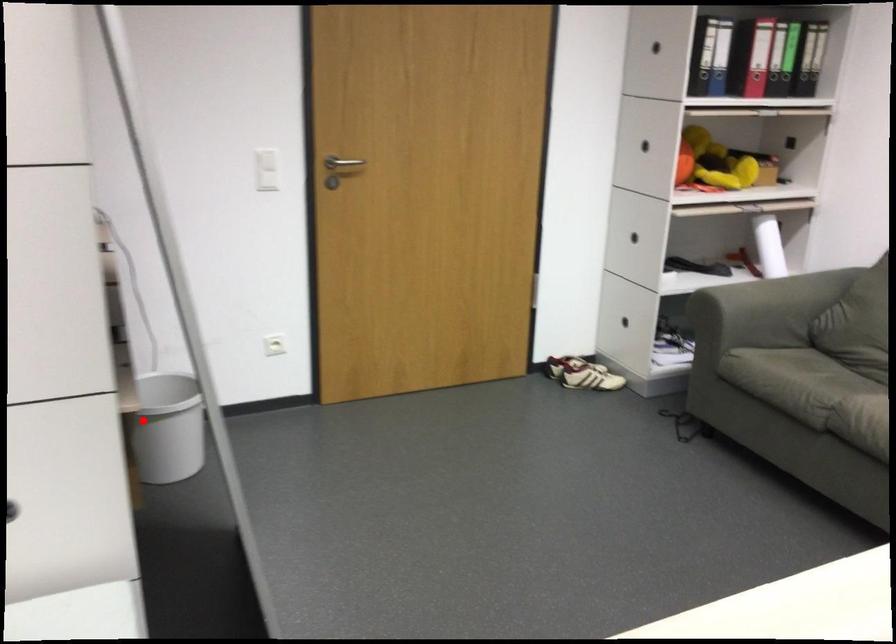
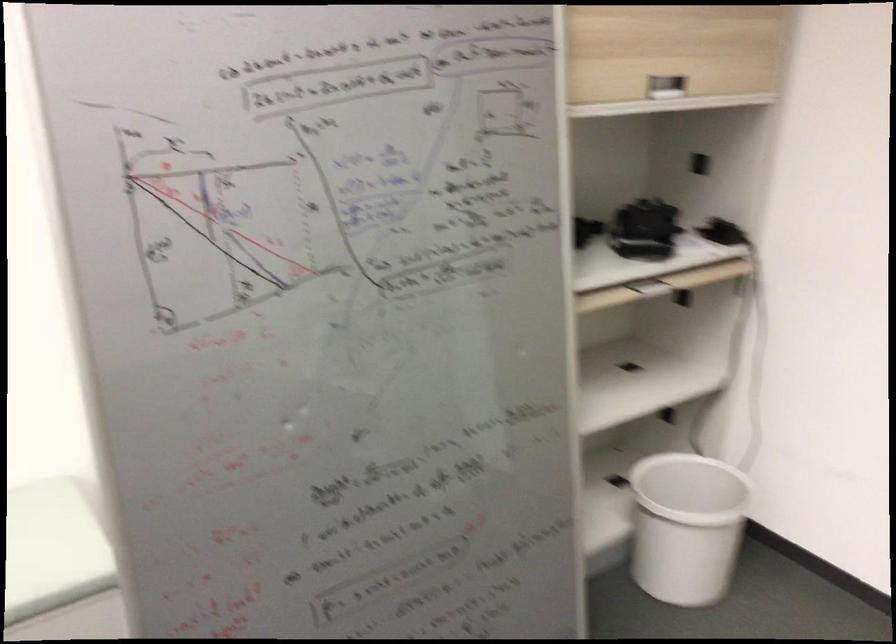
Question: I am providing you with two images of the same scene from different viewpoints. Given a red point in image1, look at the same physical point in image2. Is it:

Choices:
 (A) Closer to the viewpoint
 (B) Farther from the viewpoint

Answer: (A)